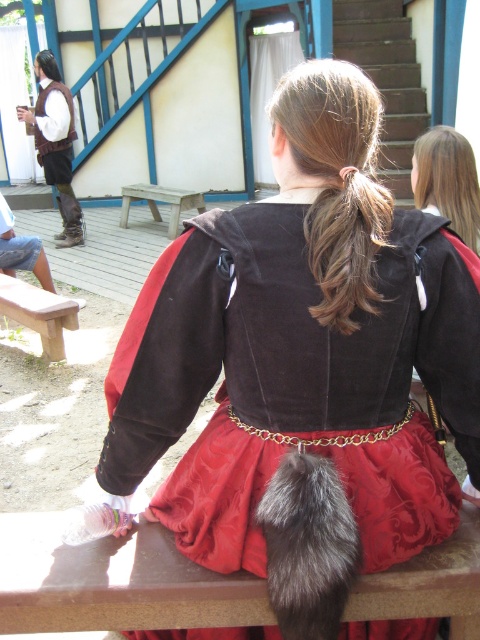
Is fuzzy fur ponytail at upper center to the right of wooden bench at left from the viewer's perspective?

Correct, you'll find fuzzy fur ponytail at upper center to the right of wooden bench at left.

Who is more forward, (334, 472) or (2, 291)?

Point (334, 472) is in front.

Identify the location of fuzzy fur ponytail at upper center. The width and height of the screenshot is (480, 640). (308, 545).

Can you confirm if fuzzy fur ponytail at upper center is positioned to the left of brown silky hair at upper center?

Correct, you'll find fuzzy fur ponytail at upper center to the left of brown silky hair at upper center.

Between fuzzy fur ponytail at upper center and brown silky hair at upper center, which one appears on the right side from the viewer's perspective?

Positioned to the right is brown silky hair at upper center.

Find the location of a particular element. fuzzy fur ponytail at upper center is located at coordinates (308, 545).

Which is above, shiny brown hair at upper right or wooden bench at left?

shiny brown hair at upper right is above.

Which is more to the left, shiny brown hair at upper right or wooden bench at left?

From the viewer's perspective, wooden bench at left appears more on the left side.

Does point (458, 205) come behind point (47, 356)?

No, it is in front of (47, 356).

Identify the location of shiny brown hair at upper right. (447, 180).